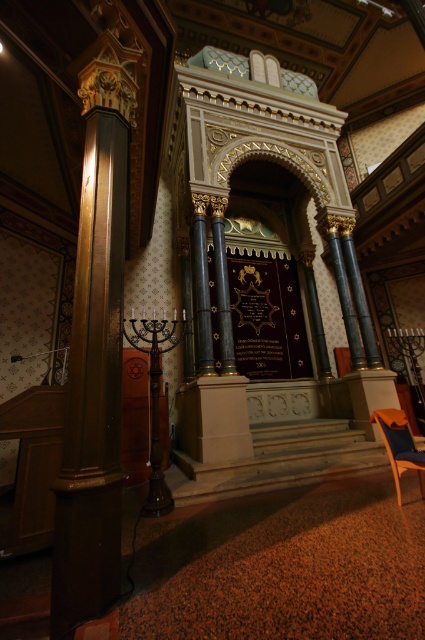
How distant is dark wood column at left from wooden armchair at lower right?

dark wood column at left is 2.71 meters away from wooden armchair at lower right.

Does dark wood column at left appear on the left side of wooden armchair at lower right?

Yes, dark wood column at left is to the left of wooden armchair at lower right.

I want to click on dark wood column at left, so click(x=93, y=388).